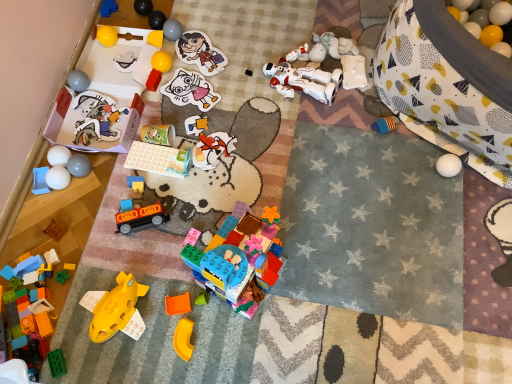
Question: Visually, is translucent plastic blocks at lower left, which appears as the fifth toy when ordered from the bottom, positioned to the left or to the right of matte blue plastic toy at center, which is the nineteenth toy from top to bottom?

Choices:
 (A) right
 (B) left

Answer: (B)

Question: In terms of width, does translucent plastic blocks at lower left, which appears as the fifth toy when ordered from the bottom, look wider or thinner when compared to matte blue plastic toy at center, which appears as the 9th toy when ordered from the bottom?

Choices:
 (A) wide
 (B) thin

Answer: (A)

Question: Considering the real-world distances, which object is farthest from the matte green cup at center, which ranks as the 15th toy in bottom-to-top order?

Choices:
 (A) white rubber balloon at upper right
 (B) translucent yellow plastic spaceship at lower left, which is the 22th toy from top to bottom
 (C) blue plastic tray at lower left, marked as the eighteenth toy in a top-to-bottom arrangement
 (D) black plastic toy at center, the 21th toy when ordered from bottom to top
 (E) white matte balls at left, the 13th toy in the bottom-to-top sequence

Answer: (A)

Question: Which of these objects is positioned closest to the translucent plastic playset at center, placed as the 14th toy when sorted from bottom to top?

Choices:
 (A) blue plastic blocks at upper left, the 27th toy positioned from the bottom
 (B) yellow plastic arch at lower center, which ranks as the 1th toy in bottom-to-top order
 (C) shiny yellow ball at center, the sixth toy from the top
 (D) translucent yellow plastic spaceship at lower left, the 24th toy when ordered from top to bottom
 (E) translucent orange plastic piece at center, the 25th toy in the top-to-bottom sequence

Answer: (C)